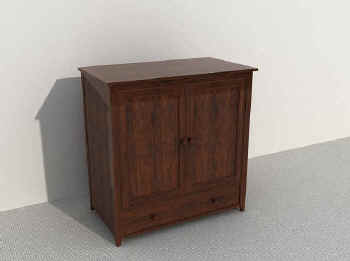
The width and height of the screenshot is (350, 261). I want to click on top surface, so click(165, 71).